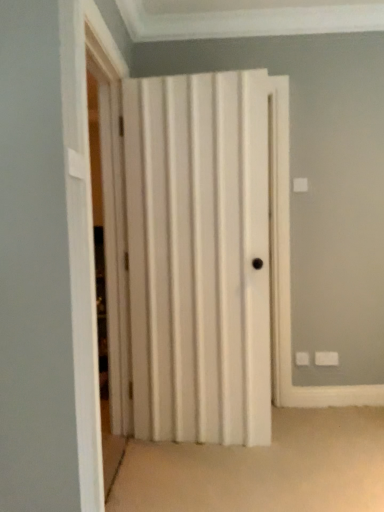
Describe the element at coordinates (206, 255) in the screenshot. The image size is (384, 512). I see `white matte door at center` at that location.

What is the approximate height of white matte door at center?

6.48 feet.

Find the location of a particular element. This screenshot has width=384, height=512. white matte door at center is located at coordinates (206, 255).

Find the location of `white wood folding door at center`. white wood folding door at center is located at coordinates (110, 206).

The width and height of the screenshot is (384, 512). Describe the element at coordinates (110, 206) in the screenshot. I see `white wood folding door at center` at that location.

You are a GUI agent. You are given a task and a screenshot of the screen. Output one action in this format:
    pyautogui.click(x=<x>, y=<y>)
    Task: Click on the white matte door at center
    The width and height of the screenshot is (384, 512).
    Given the screenshot: What is the action you would take?
    pyautogui.click(x=206, y=255)

Visually, is white matte door at center positioned to the left or to the right of white wood folding door at center?

white matte door at center is to the right of white wood folding door at center.

Which object is closer to the camera, white matte door at center or white wood folding door at center?

white wood folding door at center.

Is point (233, 356) positioned before point (100, 153)?

Yes, point (233, 356) is closer to viewer.

From the image's perspective, is white matte door at center located beneath white wood folding door at center?

Yes, from the image's perspective, white matte door at center is beneath white wood folding door at center.

From a real-world perspective, is white matte door at center located beneath white wood folding door at center?

Yes, from a real-world perspective, white matte door at center is under white wood folding door at center.

Considering the relative sizes of white matte door at center and white wood folding door at center in the image provided, is white matte door at center wider than white wood folding door at center?

Indeed, white matte door at center has a greater width compared to white wood folding door at center.

Consider the image. Is white matte door at center shorter than white wood folding door at center?

Correct, white matte door at center is not as tall as white wood folding door at center.

Is white matte door at center bigger than white wood folding door at center?

Indeed, white matte door at center has a larger size compared to white wood folding door at center.

Can we say white matte door at center lies outside white wood folding door at center?

Indeed, white matte door at center is completely outside white wood folding door at center.

Are white matte door at center and white wood folding door at center far apart?

That's not correct — white matte door at center is a little close to white wood folding door at center.

Does white matte door at center turn towards white wood folding door at center?

Yes.

What's the angular difference between white matte door at center and white wood folding door at center's facing directions?

white matte door at center and white wood folding door at center are facing 99.2 degrees away from each other.

Find the location of a particular element. door that is below the white wood folding door at center (from the image's perspective) is located at coordinates (206, 255).

In the image, is white wood folding door at center on the left side or the right side of white matte door at center?

Based on their positions, white wood folding door at center is located to the left of white matte door at center.

Is the position of white wood folding door at center more distant than that of white matte door at center?

No, white wood folding door at center is closer to the viewer.

Which is nearer, (108,117) or (170,201)?

Point (108,117) is farther from the camera than point (170,201).

From the image's perspective, is white wood folding door at center above or below white matte door at center?

From the image's perspective, white wood folding door at center appears above white matte door at center.

From a real-world perspective, is white wood folding door at center above or below white matte door at center?

white wood folding door at center is situated higher than white matte door at center in the real world.

Is white wood folding door at center wider or thinner than white matte door at center?

In the image, white wood folding door at center appears to be more narrow than white matte door at center.

Considering the relative sizes of white wood folding door at center and white matte door at center in the image provided, is white wood folding door at center taller than white matte door at center?

Correct, white wood folding door at center is much taller as white matte door at center.

In terms of size, does white wood folding door at center appear bigger or smaller than white matte door at center?

Clearly, white wood folding door at center is smaller in size than white matte door at center.

Is white wood folding door at center not within white matte door at center?

white wood folding door at center is positioned outside white matte door at center.

Is white wood folding door at center not close to white matte door at center?

That's not correct — white wood folding door at center is a little close to white matte door at center.

In the scene shown: Is white wood folding door at center turned away from white matte door at center?

Yes, white wood folding door at center's orientation is away from white matte door at center.

The image size is (384, 512). In the image, there is a white matte door at center. Identify the location of screen door above it (from the image's perspective). (110, 206).

Locate an element on the screen. The image size is (384, 512). screen door in front of the white matte door at center is located at coordinates (110, 206).

This screenshot has height=512, width=384. I want to click on door below the white wood folding door at center (from the image's perspective), so click(206, 255).